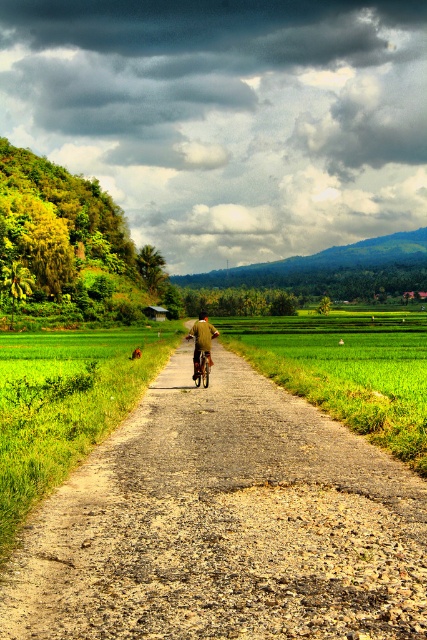
Question: Which point is closer to the camera taking this photo?

Choices:
 (A) (195, 340)
 (B) (137, 595)

Answer: (B)

Question: Which of the following is the closest to the observer?

Choices:
 (A) (380, 564)
 (B) (201, 316)

Answer: (A)

Question: Can you confirm if brown gravel road at center is positioned to the left of brown fabric jacket at center?

Choices:
 (A) no
 (B) yes

Answer: (A)

Question: Does brown gravel road at center have a larger size compared to brown fabric jacket at center?

Choices:
 (A) no
 (B) yes

Answer: (A)

Question: Does brown gravel road at center appear over brown fabric jacket at center?

Choices:
 (A) no
 (B) yes

Answer: (A)